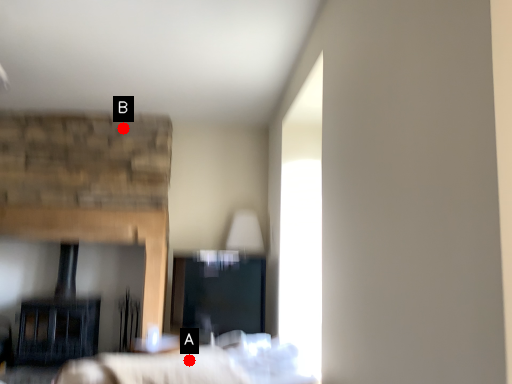
Question: Two points are circled on the image, labeled by A and B beside each circle. Which point is further to the camera?

Choices:
 (A) A is further
 (B) B is further

Answer: (B)